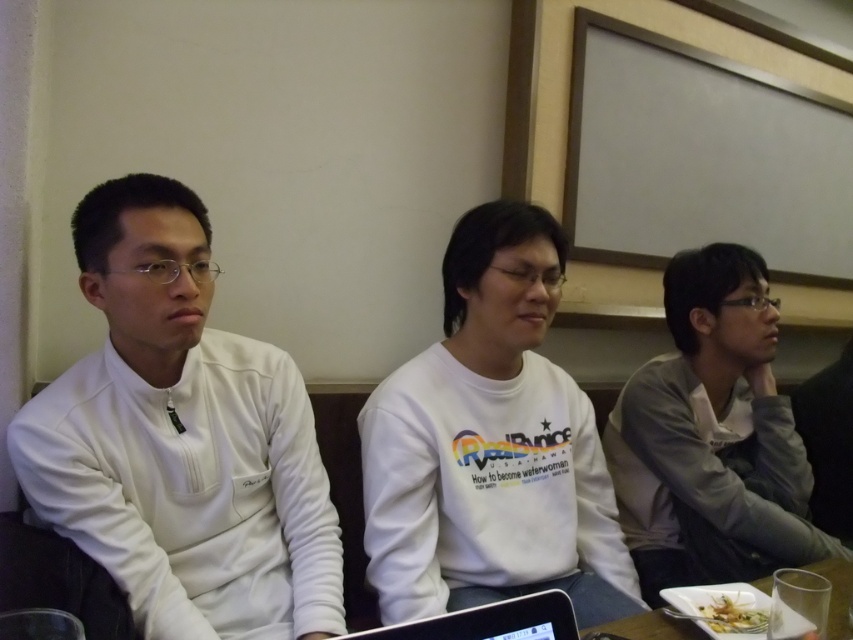
Question: Is the position of white matte sweatshirt at center more distant than that of gray fabric shirt at right?

Choices:
 (A) yes
 (B) no

Answer: (B)

Question: Which point is farther to the camera?

Choices:
 (A) pyautogui.click(x=751, y=605)
 (B) pyautogui.click(x=775, y=560)

Answer: (B)

Question: Is black glossy laptop at center thinner than green leafy salad at lower right?

Choices:
 (A) no
 (B) yes

Answer: (A)

Question: Which object is the farthest from the black glossy laptop at center?

Choices:
 (A) white matte sweatshirt at center
 (B) white plastic plate at lower right
 (C) white matte sweatshirt at left
 (D) green leafy salad at lower right

Answer: (A)

Question: Is white matte sweatshirt at left below white plastic plate at lower right?

Choices:
 (A) yes
 (B) no

Answer: (B)

Question: Which point is closer to the camera taking this photo?

Choices:
 (A) (204, 566)
 (B) (712, 621)
 (C) (471, 476)

Answer: (B)